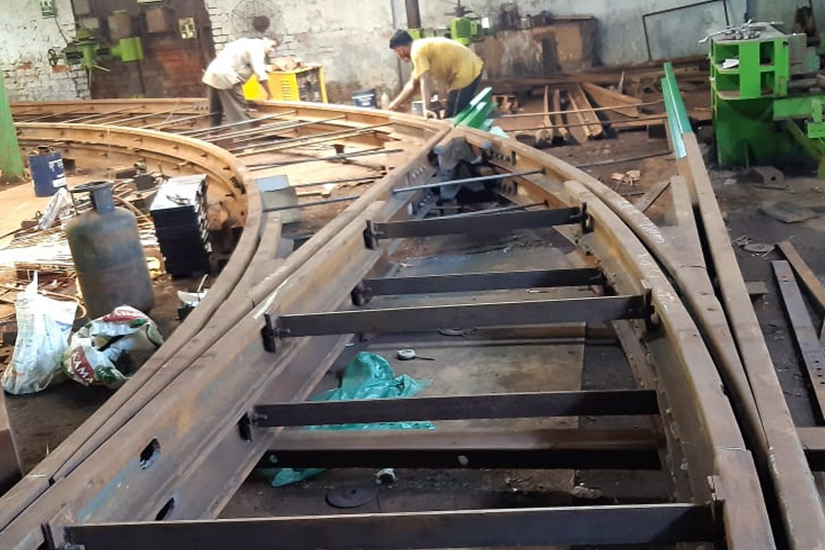
I want to click on white brick wall, so pos(347,31).